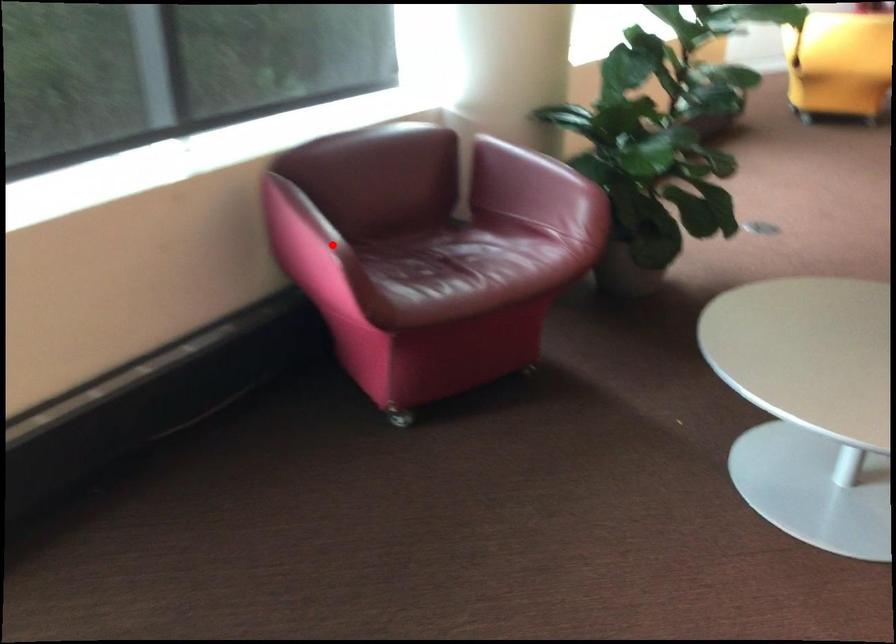
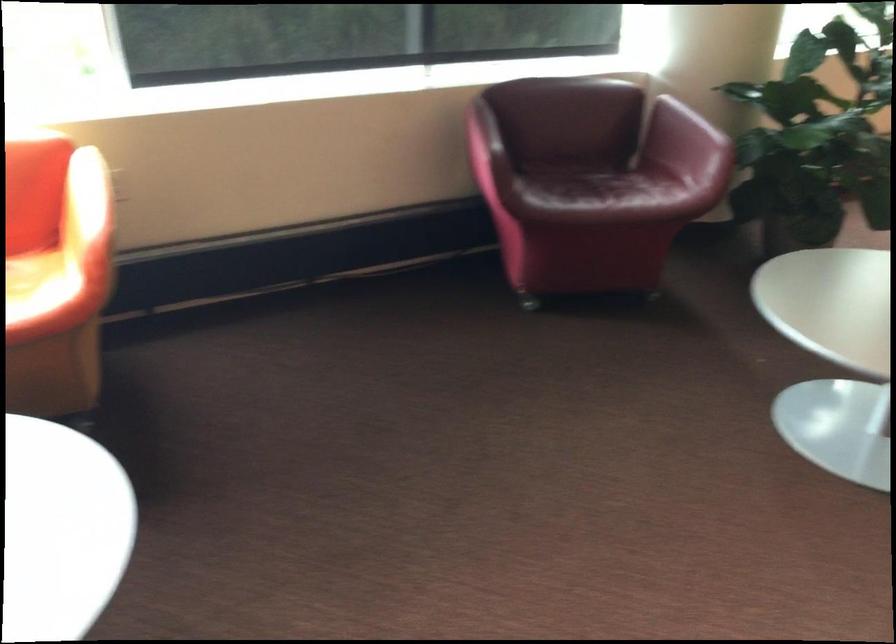
Question: I am providing you with two images of the same scene from different viewpoints. In image1, a red point is highlighted. Considering the same 3D point in image2, which of the following is correct?

Choices:
 (A) It is closer
 (B) It is farther

Answer: (B)